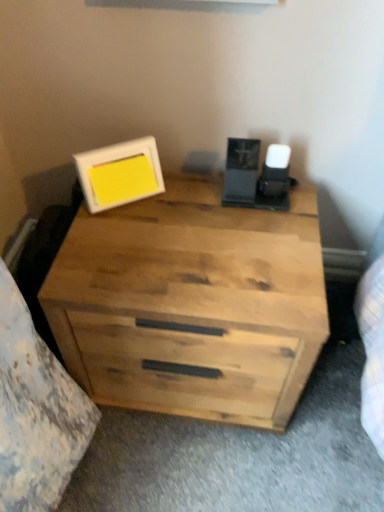
Question: Is point (251, 361) positioned closer to the camera than point (134, 183)?

Choices:
 (A) farther
 (B) closer

Answer: (B)

Question: Based on their sizes in the image, would you say natural wood chest of drawers at center is bigger or smaller than white matte picture frame at upper left?

Choices:
 (A) big
 (B) small

Answer: (A)

Question: Relative to white matte picture frame at upper left, is natural wood chest of drawers at center in front or behind?

Choices:
 (A) behind
 (B) front

Answer: (B)

Question: Is point (127, 182) positioned closer to the camera than point (155, 402)?

Choices:
 (A) closer
 (B) farther

Answer: (A)

Question: In the image, is white matte picture frame at upper left positioned in front of or behind natural wood chest of drawers at center?

Choices:
 (A) behind
 (B) front

Answer: (A)

Question: From a real-world perspective, relative to natural wood chest of drawers at center, is white matte picture frame at upper left vertically above or below?

Choices:
 (A) above
 (B) below

Answer: (A)

Question: Visually, is white matte picture frame at upper left positioned to the left or to the right of natural wood chest of drawers at center?

Choices:
 (A) left
 (B) right

Answer: (A)